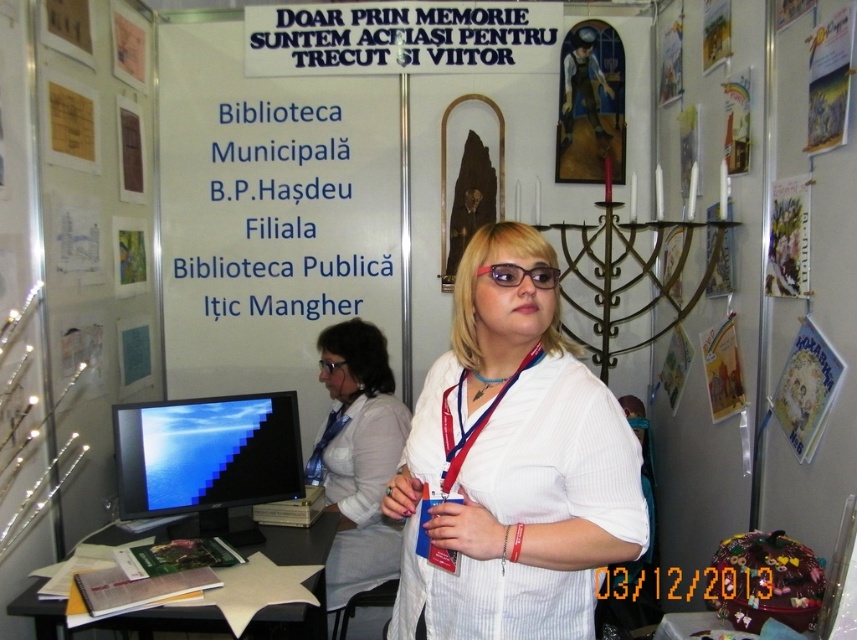
Measure the distance from matte black monitor at lower left to transparent plastic glasses at center.

A distance of 23.04 inches exists between matte black monitor at lower left and transparent plastic glasses at center.

Measure the distance between matte black monitor at lower left and camera.

matte black monitor at lower left and camera are 6.66 feet apart.

Measure the distance between matte black monitor at lower left and camera.

2.03 meters

Find the location of a particular element. matte black monitor at lower left is located at coordinates (207, 458).

Between white matte shirt at center and red fabric lanyard at center, which one is positioned lower?

Positioned lower is white matte shirt at center.

Does white matte shirt at center appear under red fabric lanyard at center?

Yes.

Is point (522, 333) behind point (508, 378)?

That is False.

Locate an element on the screen. The width and height of the screenshot is (857, 640). white matte shirt at center is located at coordinates (513, 467).

Is point (540, 534) more distant than point (150, 460)?

No, (540, 534) is closer to viewer.

Where is `white matte shirt at center`? This screenshot has height=640, width=857. white matte shirt at center is located at coordinates coord(513,467).

Where is `white matte shirt at center`? white matte shirt at center is located at coordinates (513, 467).